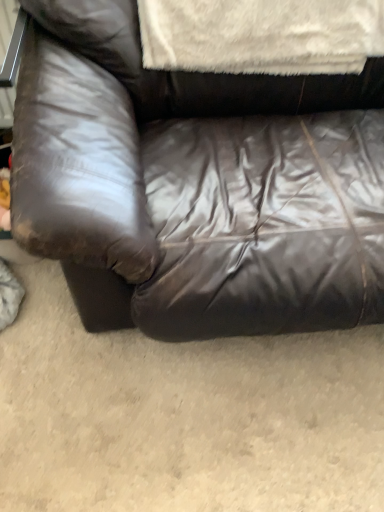
Question: From their relative heights in the image, would you say white fluffy blanket at upper center is taller or shorter than shiny brown leather couch at center?

Choices:
 (A) tall
 (B) short

Answer: (B)

Question: Is point (168, 46) closer or farther from the camera than point (115, 3)?

Choices:
 (A) farther
 (B) closer

Answer: (A)

Question: Would you say white fluffy blanket at upper center is inside or outside shiny brown leather couch at center?

Choices:
 (A) inside
 (B) outside

Answer: (A)

Question: From a real-world perspective, is shiny brown leather couch at center physically located above or below white fluffy blanket at upper center?

Choices:
 (A) above
 (B) below

Answer: (B)

Question: From the image's perspective, is shiny brown leather couch at center above or below white fluffy blanket at upper center?

Choices:
 (A) above
 (B) below

Answer: (B)

Question: Considering the relative positions of shiny brown leather couch at center and white fluffy blanket at upper center in the image provided, is shiny brown leather couch at center to the left or to the right of white fluffy blanket at upper center?

Choices:
 (A) left
 (B) right

Answer: (B)

Question: Is shiny brown leather couch at center taller or shorter than white fluffy blanket at upper center?

Choices:
 (A) short
 (B) tall

Answer: (B)